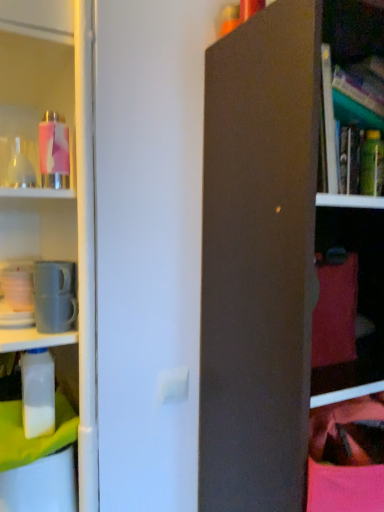
What do you see at coordinates (372, 164) in the screenshot? Image resolution: width=384 pixels, height=512 pixels. I see `green matte bottle at upper right, the 1th bottle viewed from the right` at bounding box center [372, 164].

Locate an element on the screen. white plastic bottle at left, the 1th bottle in the bottom-to-top sequence is located at coordinates (38, 393).

Find the location of a particular element. This screenshot has height=512, width=384. pink matte water bottle at upper left, the 2th bottle in the right-to-left sequence is located at coordinates (54, 151).

Does pink matte water bottle at upper left, which ranks as the fourth bottle in bottom-to-top order, have a lesser width compared to white plastic bottle at left, the fourth bottle positioned from the top?

Yes, pink matte water bottle at upper left, which ranks as the fourth bottle in bottom-to-top order, is thinner than white plastic bottle at left, the fourth bottle positioned from the top.

Is point (45, 163) positioned behind point (23, 394)?

That is False.

From a real-world perspective, is pink matte water bottle at upper left, the 2th bottle in the right-to-left sequence, positioned above or below white plastic bottle at left, the 1th bottle in the bottom-to-top sequence?

From a real-world perspective, pink matte water bottle at upper left, the 2th bottle in the right-to-left sequence, is physically above white plastic bottle at left, the 1th bottle in the bottom-to-top sequence.

How many degrees apart are the facing directions of white plastic bottle at left, the 1th bottle in the bottom-to-top sequence, and green matte bottle at upper right, the second bottle from the top?

The angle between the facing direction of white plastic bottle at left, the 1th bottle in the bottom-to-top sequence, and the facing direction of green matte bottle at upper right, the second bottle from the top, is 91.4 degrees.

Is green matte bottle at upper right, the second bottle from the top, at the back of white plastic bottle at left, which is the 3th bottle from right to left?

A: No, white plastic bottle at left, which is the 3th bottle from right to left,'s orientation is not away from green matte bottle at upper right, the second bottle from the top.

Can you confirm if white plastic bottle at left, the 1th bottle in the bottom-to-top sequence, is wider than green matte bottle at upper right, the 1th bottle viewed from the right?

Yes.

The height and width of the screenshot is (512, 384). I want to click on the 2nd bottle counting from the left of the green matte bottle at upper right, the second bottle from the top, so click(38, 393).

Would you say translucent glass bottle at upper left, the first bottle viewed from the left, contains green matte bottle at upper right, the 4th bottle from the left?

Definitely not — green matte bottle at upper right, the 4th bottle from the left, is not inside translucent glass bottle at upper left, the first bottle viewed from the left.

From the picture: From the image's perspective, which is below, translucent glass bottle at upper left, marked as the second bottle in a bottom-to-top arrangement, or green matte bottle at upper right, the 1th bottle viewed from the right?

translucent glass bottle at upper left, marked as the second bottle in a bottom-to-top arrangement.

In terms of width, does translucent glass bottle at upper left, the third bottle positioned from the top, look wider or thinner when compared to green matte bottle at upper right, the 1th bottle viewed from the right?

translucent glass bottle at upper left, the third bottle positioned from the top, is wider than green matte bottle at upper right, the 1th bottle viewed from the right.

From the picture: Is there a large distance between translucent glass bottle at upper left, the third bottle positioned from the top, and green matte bottle at upper right, the 1th bottle viewed from the right?

They are positioned close to each other.

Can you confirm if green matte bottle at upper right, the third bottle from the bottom, is wider than translucent glass bottle at upper left, the fourth bottle in the right-to-left sequence?

Incorrect, the width of green matte bottle at upper right, the third bottle from the bottom, does not surpass that of translucent glass bottle at upper left, the fourth bottle in the right-to-left sequence.

Can you confirm if green matte bottle at upper right, the 1th bottle viewed from the right, is positioned to the right of translucent glass bottle at upper left, the third bottle positioned from the top?

Correct, you'll find green matte bottle at upper right, the 1th bottle viewed from the right, to the right of translucent glass bottle at upper left, the third bottle positioned from the top.

From a real-world perspective, which bottle is the 1st one underneath the green matte bottle at upper right, the 4th bottle from the left? Please provide its 2D coordinates.

[(20, 169)]

Considering the relative sizes of translucent glass bottle at upper left, the fourth bottle in the right-to-left sequence, and white plastic bottle at left, which appears as the 2th bottle when viewed from the left, in the image provided, is translucent glass bottle at upper left, the fourth bottle in the right-to-left sequence, bigger than white plastic bottle at left, which appears as the 2th bottle when viewed from the left,?

No, translucent glass bottle at upper left, the fourth bottle in the right-to-left sequence, is not bigger than white plastic bottle at left, which appears as the 2th bottle when viewed from the left.

How many degrees apart are the facing directions of translucent glass bottle at upper left, the third bottle positioned from the top, and white plastic bottle at left, which appears as the 2th bottle when viewed from the left?

They differ by 0.948 degrees in their facing directions.

Is translucent glass bottle at upper left, the third bottle positioned from the top, next to white plastic bottle at left, which is the 3th bottle from right to left, and touching it?

No, translucent glass bottle at upper left, the third bottle positioned from the top, is not making contact with white plastic bottle at left, which is the 3th bottle from right to left.

Measure the distance between translucent glass bottle at upper left, the fourth bottle in the right-to-left sequence, and white plastic bottle at left, which is the 3th bottle from right to left.

18.07 inches.

Is pink matte water bottle at upper left, marked as the 1th bottle in a top-to-bottom arrangement, bigger than green matte bottle at upper right, the third bottle from the bottom?

Yes.

Consider the image. From a real-world perspective, is pink matte water bottle at upper left, the third bottle in the left-to-right sequence, located higher than green matte bottle at upper right, the third bottle from the bottom?

Yes.

Identify the location of bottle located above the green matte bottle at upper right, the 4th bottle from the left (from a real-world perspective). (54, 151).

From the image's perspective, does pink matte water bottle at upper left, the third bottle in the left-to-right sequence, appear lower than green matte bottle at upper right, the 4th bottle from the left?

No.

Consider the image. Can you confirm if pink matte water bottle at upper left, the 2th bottle in the right-to-left sequence, is wider than translucent glass bottle at upper left, the third bottle positioned from the top?

Correct, the width of pink matte water bottle at upper left, the 2th bottle in the right-to-left sequence, exceeds that of translucent glass bottle at upper left, the third bottle positioned from the top.

In the scene shown: Can you confirm if pink matte water bottle at upper left, marked as the 1th bottle in a top-to-bottom arrangement, is shorter than translucent glass bottle at upper left, the fourth bottle in the right-to-left sequence?

No, pink matte water bottle at upper left, marked as the 1th bottle in a top-to-bottom arrangement, is not shorter than translucent glass bottle at upper left, the fourth bottle in the right-to-left sequence.

I want to click on the 1st bottle behind when counting from the pink matte water bottle at upper left, marked as the 1th bottle in a top-to-bottom arrangement, so click(x=20, y=169).

Who is bigger, pink matte water bottle at upper left, marked as the 1th bottle in a top-to-bottom arrangement, or translucent glass bottle at upper left, the third bottle positioned from the top?

With larger size is pink matte water bottle at upper left, marked as the 1th bottle in a top-to-bottom arrangement.

Identify the location of the 3rd bottle below when counting from the pink matte water bottle at upper left, which ranks as the fourth bottle in bottom-to-top order (from the image's perspective). The height and width of the screenshot is (512, 384). (38, 393).

You are a GUI agent. You are given a task and a screenshot of the screen. Output one action in this format:
    pyautogui.click(x=<x>, y=<y>)
    Task: Click on the bottle behind the white plastic bottle at left, which is the 3th bottle from right to left
    Image resolution: width=384 pixels, height=512 pixels.
    Given the screenshot: What is the action you would take?
    pyautogui.click(x=372, y=164)

Considering their positions, is pink matte water bottle at upper left, the 2th bottle in the right-to-left sequence, positioned further to translucent glass bottle at upper left, the third bottle positioned from the top, than white plastic bottle at left, which is the 3th bottle from right to left?

Among the two, white plastic bottle at left, which is the 3th bottle from right to left, is located further to translucent glass bottle at upper left, the third bottle positioned from the top.

Based on their spatial positions, is pink matte water bottle at upper left, the 2th bottle in the right-to-left sequence, or white plastic bottle at left, the 1th bottle in the bottom-to-top sequence, further from green matte bottle at upper right, the 4th bottle from the left?

A: white plastic bottle at left, the 1th bottle in the bottom-to-top sequence, is positioned further to the anchor green matte bottle at upper right, the 4th bottle from the left.

Estimate the real-world distances between objects in this image. Which object is closer to translucent glass bottle at upper left, marked as the second bottle in a bottom-to-top arrangement, white plastic bottle at left, the 1th bottle in the bottom-to-top sequence, or green matte bottle at upper right, the third bottle from the bottom?

white plastic bottle at left, the 1th bottle in the bottom-to-top sequence, lies closer to translucent glass bottle at upper left, marked as the second bottle in a bottom-to-top arrangement, than the other object.

Based on the photo, when comparing their distances from white plastic bottle at left, the fourth bottle positioned from the top, does translucent glass bottle at upper left, the third bottle positioned from the top, or green matte bottle at upper right, the second bottle from the top, seem further?

The object further to white plastic bottle at left, the fourth bottle positioned from the top, is green matte bottle at upper right, the second bottle from the top.

Based on their spatial positions, is white plastic bottle at left, the fourth bottle positioned from the top, or translucent glass bottle at upper left, the first bottle viewed from the left, further from pink matte water bottle at upper left, which ranks as the fourth bottle in bottom-to-top order?

white plastic bottle at left, the fourth bottle positioned from the top, is positioned further to the anchor pink matte water bottle at upper left, which ranks as the fourth bottle in bottom-to-top order.

In the scene shown: Looking at the image, which one is located closer to translucent glass bottle at upper left, marked as the second bottle in a bottom-to-top arrangement, white plastic bottle at left, the 1th bottle in the bottom-to-top sequence, or pink matte water bottle at upper left, the third bottle in the left-to-right sequence?

pink matte water bottle at upper left, the third bottle in the left-to-right sequence, lies closer to translucent glass bottle at upper left, marked as the second bottle in a bottom-to-top arrangement, than the other object.

Which object lies further to the anchor point green matte bottle at upper right, the second bottle from the top, pink matte water bottle at upper left, which ranks as the fourth bottle in bottom-to-top order, or translucent glass bottle at upper left, marked as the second bottle in a bottom-to-top arrangement?

translucent glass bottle at upper left, marked as the second bottle in a bottom-to-top arrangement, is further to green matte bottle at upper right, the second bottle from the top.

Which object lies further to the anchor point green matte bottle at upper right, the third bottle from the bottom, white plastic bottle at left, the 1th bottle in the bottom-to-top sequence, or pink matte water bottle at upper left, marked as the 1th bottle in a top-to-bottom arrangement?

Among the two, white plastic bottle at left, the 1th bottle in the bottom-to-top sequence, is located further to green matte bottle at upper right, the third bottle from the bottom.

The width and height of the screenshot is (384, 512). Identify the location of bottle between white plastic bottle at left, the 1th bottle in the bottom-to-top sequence, and green matte bottle at upper right, the second bottle from the top, in the horizontal direction. pyautogui.click(x=54, y=151).